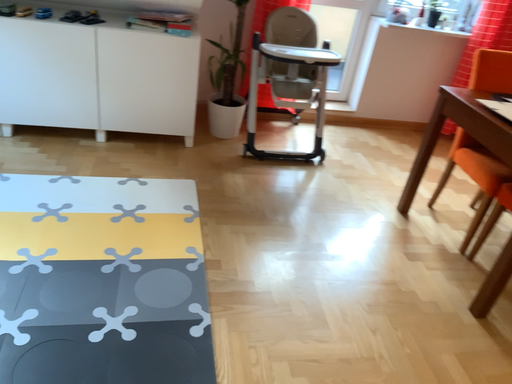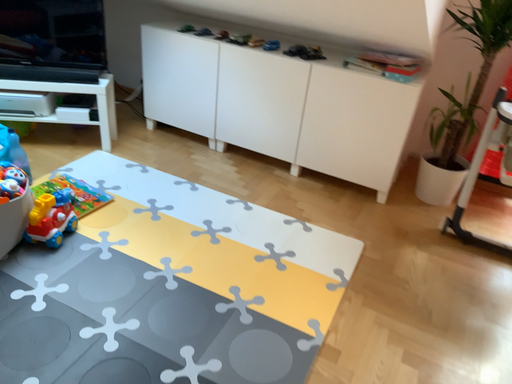
Question: How did the camera likely rotate when shooting the video?

Choices:
 (A) rotated left
 (B) rotated right

Answer: (A)